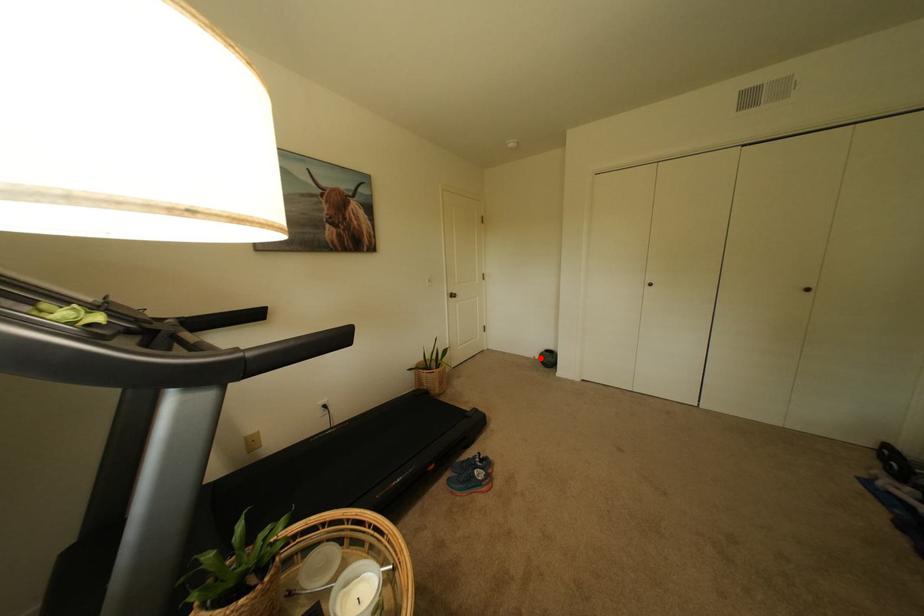
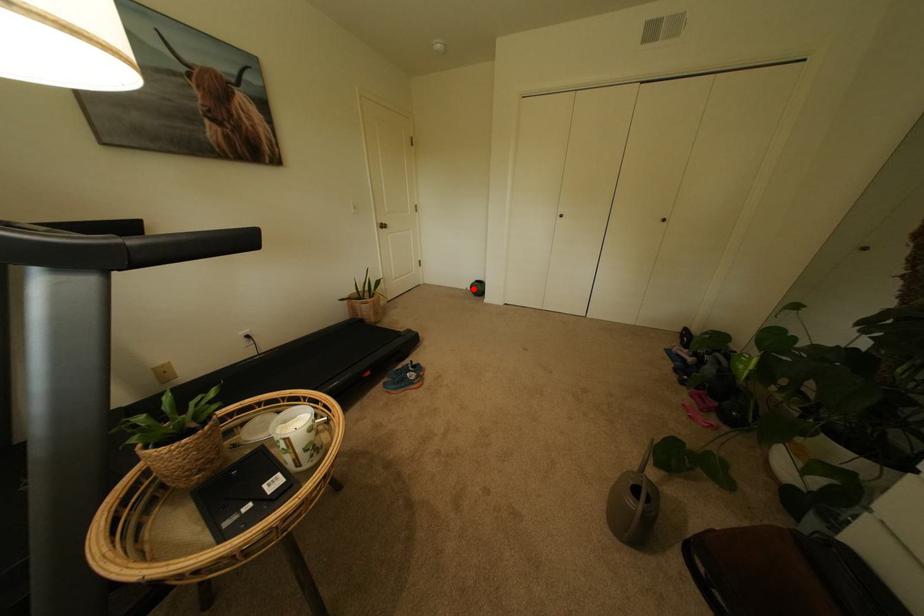
I am providing you with two images of the same scene from different viewpoints. A red point is marked on the first image and another point is marked on the second image. Is the red point in image1 aligned with the point shown in image2?

Yes